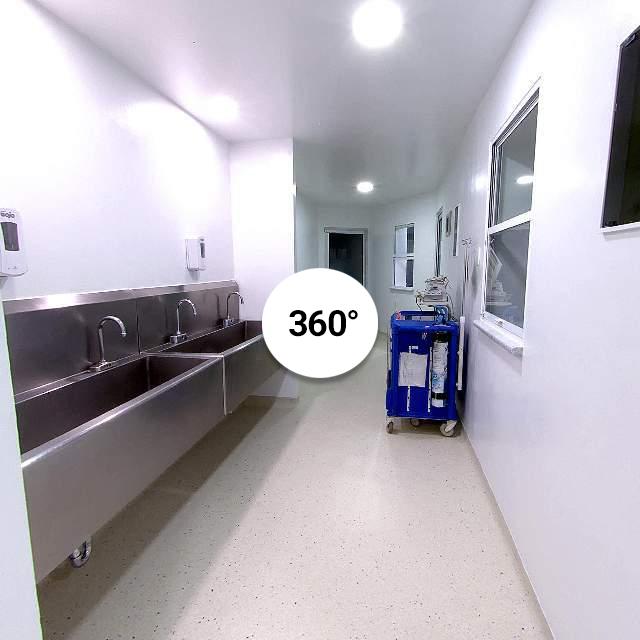
At what (x,y) coordinates should I click in order to perform the action: click on faucet, curved. Please return your answer as a coordinate pair (x, y). Looking at the image, I should click on (102, 336), (180, 310), (228, 304).